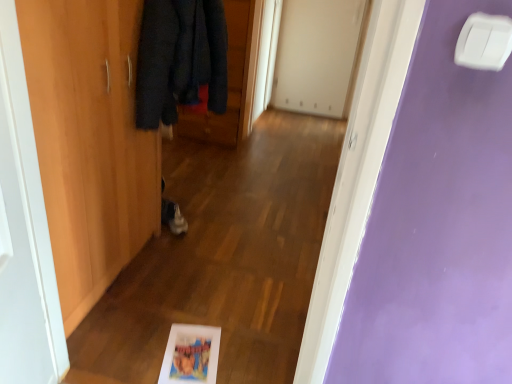
Question: Can white wood door at left, the 2th door from the right, be found inside wooden wardrobe at left, the 2th door positioned from the front?

Choices:
 (A) yes
 (B) no

Answer: (B)

Question: From a real-world perspective, is wooden wardrobe at left, the second door when ordered from back to front, beneath white wood door at left, which appears as the 1th door when viewed from the front?

Choices:
 (A) no
 (B) yes

Answer: (B)

Question: Is wooden wardrobe at left, arranged as the 1th door when viewed from the left, at the left side of white wood door at left, positioned as the third door in back-to-front order?

Choices:
 (A) no
 (B) yes

Answer: (B)

Question: Is wooden wardrobe at left, the second door when ordered from back to front, facing away from white wood door at left, which appears as the 1th door when viewed from the front?

Choices:
 (A) no
 (B) yes

Answer: (A)

Question: Does wooden wardrobe at left, arranged as the 1th door when viewed from the left, have a lesser height compared to white wood door at left, positioned as the third door in back-to-front order?

Choices:
 (A) no
 (B) yes

Answer: (A)

Question: Is wooden wardrobe at left, the second door when ordered from back to front, positioned behind white wood door at left, positioned as the third door in back-to-front order?

Choices:
 (A) yes
 (B) no

Answer: (A)

Question: Is white wood door at left, positioned as the third door in back-to-front order, a part of matte plastic picture frame at lower center?

Choices:
 (A) no
 (B) yes

Answer: (A)

Question: Can you confirm if matte plastic picture frame at lower center is smaller than white wood door at left, positioned as the third door in back-to-front order?

Choices:
 (A) no
 (B) yes

Answer: (B)

Question: Considering the relative sizes of matte plastic picture frame at lower center and white wood door at left, which appears as the 1th door when viewed from the front, in the image provided, is matte plastic picture frame at lower center thinner than white wood door at left, which appears as the 1th door when viewed from the front,?

Choices:
 (A) yes
 (B) no

Answer: (B)

Question: Can you confirm if matte plastic picture frame at lower center is taller than white wood door at left, positioned as the third door in back-to-front order?

Choices:
 (A) yes
 (B) no

Answer: (B)

Question: Is matte plastic picture frame at lower center behind white wood door at left, the 2th door from the right?

Choices:
 (A) yes
 (B) no

Answer: (A)

Question: Can you confirm if matte plastic picture frame at lower center is wider than white wood door at left, which appears as the 1th door when viewed from the front?

Choices:
 (A) no
 (B) yes

Answer: (B)

Question: Is white wood door at left, positioned as the third door in back-to-front order, completely or partially outside of dark blue woolen coat at upper left?

Choices:
 (A) no
 (B) yes

Answer: (B)